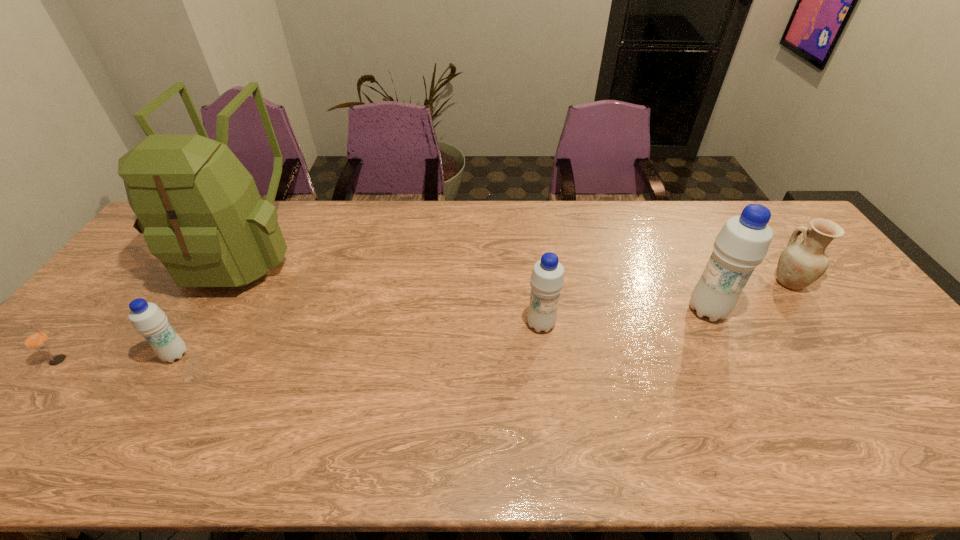
Identify the location of free space that is in between the leftmost water bottle and the fifth object from left to right. (442, 333).

In order to click on blank region between the pottery and the backpack in this screenshot , I will do `click(516, 267)`.

Image resolution: width=960 pixels, height=540 pixels. In order to click on free space that is in between the second object from right to left and the shortest object in this screenshot , I will do `click(383, 335)`.

Find the location of a particular element. Image resolution: width=960 pixels, height=540 pixels. free spot between the straw and the nearest water bottle is located at coordinates (117, 357).

Where is `empty space that is in between the fourth shortest object and the leftmost object`? Image resolution: width=960 pixels, height=540 pixels. empty space that is in between the fourth shortest object and the leftmost object is located at coordinates (300, 342).

Choose which object is the nearest neighbor to the pottery. Please provide its 2D coordinates. Your answer should be formatted as a tuple, i.e. [(x, y)], where the tuple contains the x and y coordinates of a point satisfying the conditions above.

[(742, 243)]

Find the location of `object that stands as the closest to the shortest water bottle`. object that stands as the closest to the shortest water bottle is located at coordinates (199, 209).

Select which water bottle is the closest to the pottery. Please provide its 2D coordinates. Your answer should be formatted as a tuple, i.e. [(x, y)], where the tuple contains the x and y coordinates of a point satisfying the conditions above.

[(742, 243)]

Point out which water bottle is positioned as the second nearest to the straw. Please provide its 2D coordinates. Your answer should be formatted as a tuple, i.e. [(x, y)], where the tuple contains the x and y coordinates of a point satisfying the conditions above.

[(547, 279)]

Find the location of a particular element. vacant region that satisfies the following two spatial constraints: 1. on the back side of the rightmost water bottle; 2. on the left side of the pottery is located at coordinates (693, 282).